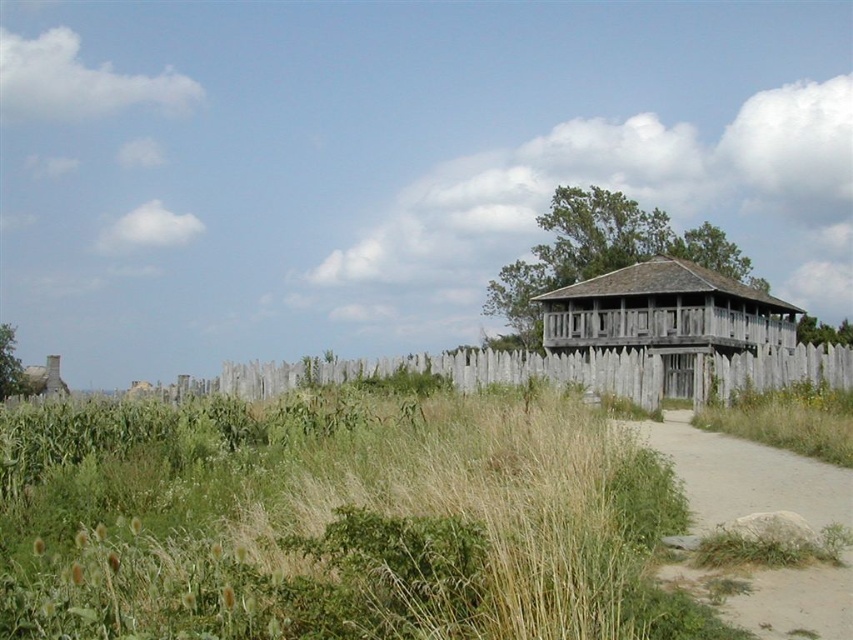
In the scene shown: Between green grass at center and weathered wood tower at center-right, which one is positioned higher?

Positioned higher is weathered wood tower at center-right.

Does green grass at center come in front of weathered wood tower at center-right?

Yes.

Identify the location of green grass at center. (331, 518).

Which of these two, dirt path at lower right or weathered wood fence at center, stands shorter?

dirt path at lower right is shorter.

Can you confirm if dirt path at lower right is wider than weathered wood fence at center?

No.

Which is in front, point (759, 499) or point (415, 365)?

Point (759, 499)

Where is `dirt path at lower right`? dirt path at lower right is located at coordinates (743, 474).

Is dirt path at lower right bigger than weathered wood tower at center-right?

Incorrect, dirt path at lower right is not larger than weathered wood tower at center-right.

Does dirt path at lower right appear under weathered wood tower at center-right?

Yes, dirt path at lower right is below weathered wood tower at center-right.

The width and height of the screenshot is (853, 640). Identify the location of dirt path at lower right. (743, 474).